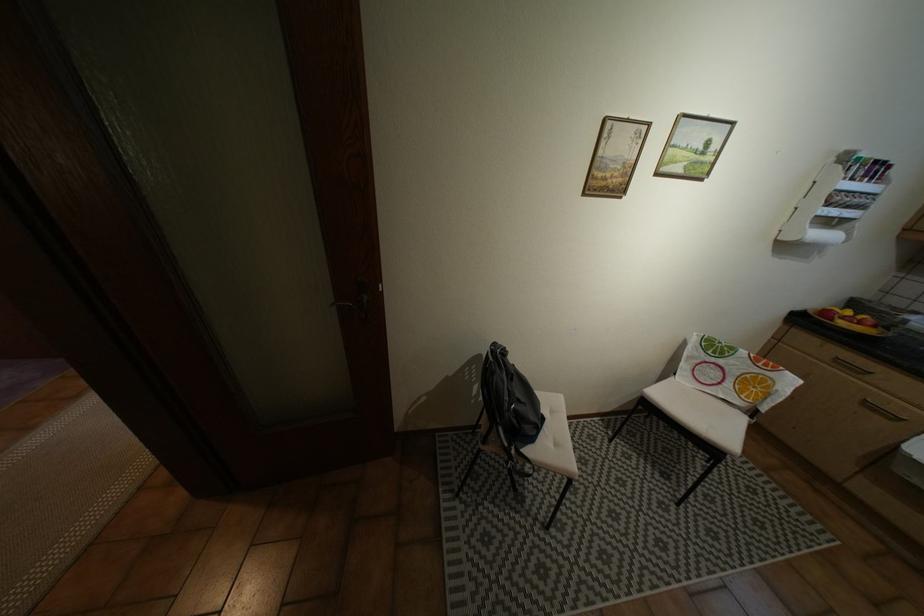
The location [509,400] corresponds to which object?

It refers to a gray backpack.